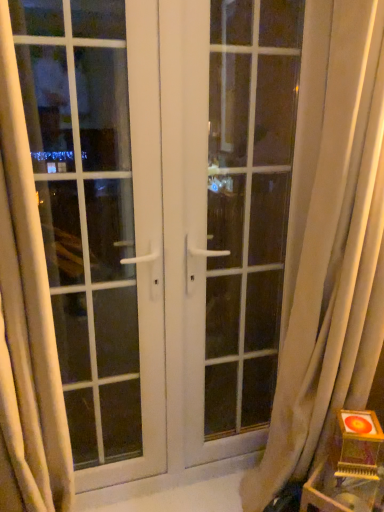
Question: Is white glossy door at center to the left or to the right of white sheer curtain at left, placed as the second curtain when sorted from right to left, in the image?

Choices:
 (A) right
 (B) left

Answer: (A)

Question: In terms of width, does white glossy door at center look wider or thinner when compared to white sheer curtain at left, the 1th curtain viewed from the left?

Choices:
 (A) wide
 (B) thin

Answer: (B)

Question: Which is nearer to the white glass window at center?

Choices:
 (A) white sheer curtain at left, the 1th curtain viewed from the left
 (B) white sheer curtain at right, the first curtain in the right-to-left sequence
 (C) wooden table at lower right
 (D) white glossy door at center

Answer: (D)

Question: Considering the real-world distances, which object is farthest from the white glossy door at center?

Choices:
 (A) wooden table at lower right
 (B) white glass window at center
 (C) white sheer curtain at left, placed as the second curtain when sorted from right to left
 (D) white sheer curtain at right, acting as the 2th curtain starting from the left

Answer: (C)